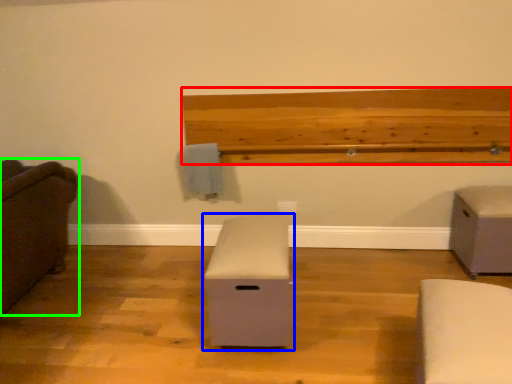
Question: Which object is positioned farthest from ledge (highlighted by a red box)? Select from furniture (highlighted by a blue box) and furniture (highlighted by a green box).

Choices:
 (A) furniture
 (B) furniture

Answer: (B)